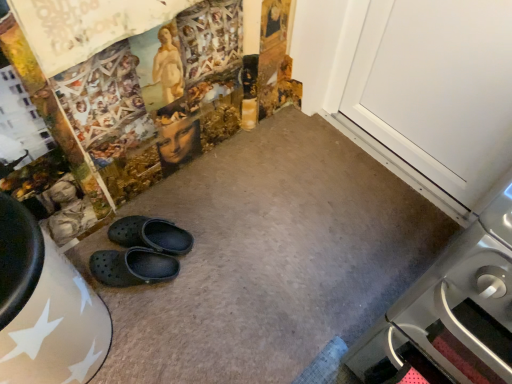
The image size is (512, 384). Describe the element at coordinates (132, 267) in the screenshot. I see `black rubber clogs at center, the first footwear ordered from the bottom` at that location.

Find the location of `black rubber clogs at lower left, marked as the 2th footwear in a bottom-to-top arrangement`. black rubber clogs at lower left, marked as the 2th footwear in a bottom-to-top arrangement is located at coordinates tap(151, 235).

Locate an element on the screen. stainless steel oven at lower right is located at coordinates (451, 312).

Describe the element at coordinates (451, 312) in the screenshot. I see `stainless steel oven at lower right` at that location.

Identify the location of white smooth door at upper right. This screenshot has height=384, width=512. (437, 90).

Find the location of `black rubber clogs at center, placed as the 2th footwear when sorted from top to bottom`. black rubber clogs at center, placed as the 2th footwear when sorted from top to bottom is located at coordinates (132, 267).

Are black rubber clogs at center, the first footwear ordered from the bottom, and stainless steel oven at lower right beside each other?

No, black rubber clogs at center, the first footwear ordered from the bottom, is not beside stainless steel oven at lower right.

From a real-world perspective, who is located lower, black rubber clogs at center, the first footwear ordered from the bottom, or stainless steel oven at lower right?

In real-world perspective, black rubber clogs at center, the first footwear ordered from the bottom, is lower.

Can you tell me how much black rubber clogs at center, placed as the 2th footwear when sorted from top to bottom, and stainless steel oven at lower right differ in facing direction?

There is a 49.2-degree angle between the facing directions of black rubber clogs at center, placed as the 2th footwear when sorted from top to bottom, and stainless steel oven at lower right.

Considering the relative sizes of black rubber clogs at center, the first footwear ordered from the bottom, and stainless steel oven at lower right in the image provided, is black rubber clogs at center, the first footwear ordered from the bottom, taller than stainless steel oven at lower right?

Incorrect, the height of black rubber clogs at center, the first footwear ordered from the bottom, is not larger of that of stainless steel oven at lower right.

Is the surface of stainless steel oven at lower right in direct contact with black rubber clogs at lower left, marked as the 2th footwear in a bottom-to-top arrangement?

There is a gap between stainless steel oven at lower right and black rubber clogs at lower left, marked as the 2th footwear in a bottom-to-top arrangement.

Locate an element on the screen. The height and width of the screenshot is (384, 512). home appliance lying below the black rubber clogs at lower left, which appears as the first footwear when viewed from the top (from the image's perspective) is located at coordinates (451, 312).

Which object is closer to the camera, stainless steel oven at lower right or black rubber clogs at lower left, marked as the 2th footwear in a bottom-to-top arrangement?

stainless steel oven at lower right is in front.

Is black rubber clogs at lower left, marked as the 2th footwear in a bottom-to-top arrangement, next to stainless steel oven at lower right?

No.

Is the position of black rubber clogs at lower left, which appears as the first footwear when viewed from the top, more distant than that of stainless steel oven at lower right?

Yes, it is.

Between black rubber clogs at lower left, marked as the 2th footwear in a bottom-to-top arrangement, and stainless steel oven at lower right, which one appears on the left side from the viewer's perspective?

black rubber clogs at lower left, marked as the 2th footwear in a bottom-to-top arrangement.

Based on their sizes in the image, would you say black rubber clogs at lower left, which appears as the first footwear when viewed from the top, is bigger or smaller than stainless steel oven at lower right?

Considering their sizes, black rubber clogs at lower left, which appears as the first footwear when viewed from the top, takes up less space than stainless steel oven at lower right.

From the image's perspective, which footwear is the 1st one above the stainless steel oven at lower right? Please provide its 2D coordinates.

[(132, 267)]

How different are the orientations of stainless steel oven at lower right and black rubber clogs at center, the first footwear ordered from the bottom, in degrees?

The facing directions of stainless steel oven at lower right and black rubber clogs at center, the first footwear ordered from the bottom, are 49.2 degrees apart.

Is the surface of stainless steel oven at lower right in direct contact with black rubber clogs at center, the first footwear ordered from the bottom?

There is a gap between stainless steel oven at lower right and black rubber clogs at center, the first footwear ordered from the bottom.

Which is behind, stainless steel oven at lower right or black rubber clogs at center, placed as the 2th footwear when sorted from top to bottom?

black rubber clogs at center, placed as the 2th footwear when sorted from top to bottom.

Which point is more distant from viewer, (431, 106) or (119, 230)?

Positioned behind is point (431, 106).

Which object is positioned more to the left, white smooth door at upper right or black rubber clogs at lower left, marked as the 2th footwear in a bottom-to-top arrangement?

Positioned to the left is black rubber clogs at lower left, marked as the 2th footwear in a bottom-to-top arrangement.

Consider the image. Is white smooth door at upper right not near black rubber clogs at lower left, which appears as the first footwear when viewed from the top?

No, there isn't a large distance between white smooth door at upper right and black rubber clogs at lower left, which appears as the first footwear when viewed from the top.

From a real-world perspective, is white smooth door at upper right physically located above or below black rubber clogs at lower left, which appears as the first footwear when viewed from the top?

white smooth door at upper right is situated higher than black rubber clogs at lower left, which appears as the first footwear when viewed from the top, in the real world.

Relative to black rubber clogs at center, the first footwear ordered from the bottom, is white smooth door at upper right in front or behind?

Visually, white smooth door at upper right is located in front of black rubber clogs at center, the first footwear ordered from the bottom.

Is white smooth door at upper right smaller than black rubber clogs at center, placed as the 2th footwear when sorted from top to bottom?

Incorrect, white smooth door at upper right is not smaller in size than black rubber clogs at center, placed as the 2th footwear when sorted from top to bottom.

Could you tell me if white smooth door at upper right is turned towards black rubber clogs at center, placed as the 2th footwear when sorted from top to bottom?

Yes, white smooth door at upper right is aimed at black rubber clogs at center, placed as the 2th footwear when sorted from top to bottom.

Considering the positions of objects white smooth door at upper right and black rubber clogs at center, the first footwear ordered from the bottom, in the image provided, who is more to the right, white smooth door at upper right or black rubber clogs at center, the first footwear ordered from the bottom,?

From the viewer's perspective, white smooth door at upper right appears more on the right side.

Which object is positioned more to the right, white smooth door at upper right or stainless steel oven at lower right?

From the viewer's perspective, stainless steel oven at lower right appears more on the right side.

In terms of height, does white smooth door at upper right look taller or shorter compared to stainless steel oven at lower right?

Clearly, white smooth door at upper right is shorter compared to stainless steel oven at lower right.

Are white smooth door at upper right and stainless steel oven at lower right located far from each other?

No, white smooth door at upper right is in close proximity to stainless steel oven at lower right.

Is white smooth door at upper right thinner than stainless steel oven at lower right?

Correct, the width of white smooth door at upper right is less than that of stainless steel oven at lower right.

I want to click on home appliance below the black rubber clogs at center, the first footwear ordered from the bottom (from the image's perspective), so click(451, 312).

The height and width of the screenshot is (384, 512). Find the location of `home appliance above the black rubber clogs at lower left, which appears as the first footwear when viewed from the top (from a real-world perspective)`. home appliance above the black rubber clogs at lower left, which appears as the first footwear when viewed from the top (from a real-world perspective) is located at coordinates (451, 312).

Looking at the image, which one is located further to black rubber clogs at center, the first footwear ordered from the bottom, stainless steel oven at lower right or white smooth door at upper right?

The object further to black rubber clogs at center, the first footwear ordered from the bottom, is white smooth door at upper right.

When comparing their distances from black rubber clogs at lower left, which appears as the first footwear when viewed from the top, does black rubber clogs at center, placed as the 2th footwear when sorted from top to bottom, or stainless steel oven at lower right seem closer?

The object closer to black rubber clogs at lower left, which appears as the first footwear when viewed from the top, is black rubber clogs at center, placed as the 2th footwear when sorted from top to bottom.

Which object lies nearer to the anchor point stainless steel oven at lower right, black rubber clogs at lower left, marked as the 2th footwear in a bottom-to-top arrangement, or white smooth door at upper right?

white smooth door at upper right.

Looking at this image, from the image, which object appears to be farther from black rubber clogs at center, placed as the 2th footwear when sorted from top to bottom, white smooth door at upper right or stainless steel oven at lower right?

white smooth door at upper right lies further to black rubber clogs at center, placed as the 2th footwear when sorted from top to bottom, than the other object.

When comparing their distances from black rubber clogs at center, placed as the 2th footwear when sorted from top to bottom, does stainless steel oven at lower right or black rubber clogs at lower left, marked as the 2th footwear in a bottom-to-top arrangement, seem further?

A: The object further to black rubber clogs at center, placed as the 2th footwear when sorted from top to bottom, is stainless steel oven at lower right.

Looking at the image, which one is located further to stainless steel oven at lower right, black rubber clogs at center, placed as the 2th footwear when sorted from top to bottom, or white smooth door at upper right?

Based on the image, black rubber clogs at center, placed as the 2th footwear when sorted from top to bottom, appears to be further to stainless steel oven at lower right.

Estimate the real-world distances between objects in this image. Which object is further from black rubber clogs at center, the first footwear ordered from the bottom, white smooth door at upper right or black rubber clogs at lower left, marked as the 2th footwear in a bottom-to-top arrangement?

Among the two, white smooth door at upper right is located further to black rubber clogs at center, the first footwear ordered from the bottom.

Considering their positions, is black rubber clogs at center, placed as the 2th footwear when sorted from top to bottom, positioned closer to stainless steel oven at lower right than black rubber clogs at lower left, which appears as the first footwear when viewed from the top?

black rubber clogs at center, placed as the 2th footwear when sorted from top to bottom, is closer to stainless steel oven at lower right.

The height and width of the screenshot is (384, 512). I want to click on footwear situated between black rubber clogs at center, placed as the 2th footwear when sorted from top to bottom, and white smooth door at upper right from left to right, so click(x=151, y=235).

I want to click on door between black rubber clogs at lower left, marked as the 2th footwear in a bottom-to-top arrangement, and stainless steel oven at lower right, so click(x=437, y=90).

Locate an element on the screen. This screenshot has height=384, width=512. door between black rubber clogs at center, the first footwear ordered from the bottom, and stainless steel oven at lower right, in the horizontal direction is located at coordinates [x=437, y=90].

Where is `footwear between black rubber clogs at center, the first footwear ordered from the bottom, and stainless steel oven at lower right`? This screenshot has height=384, width=512. footwear between black rubber clogs at center, the first footwear ordered from the bottom, and stainless steel oven at lower right is located at coordinates coord(151,235).